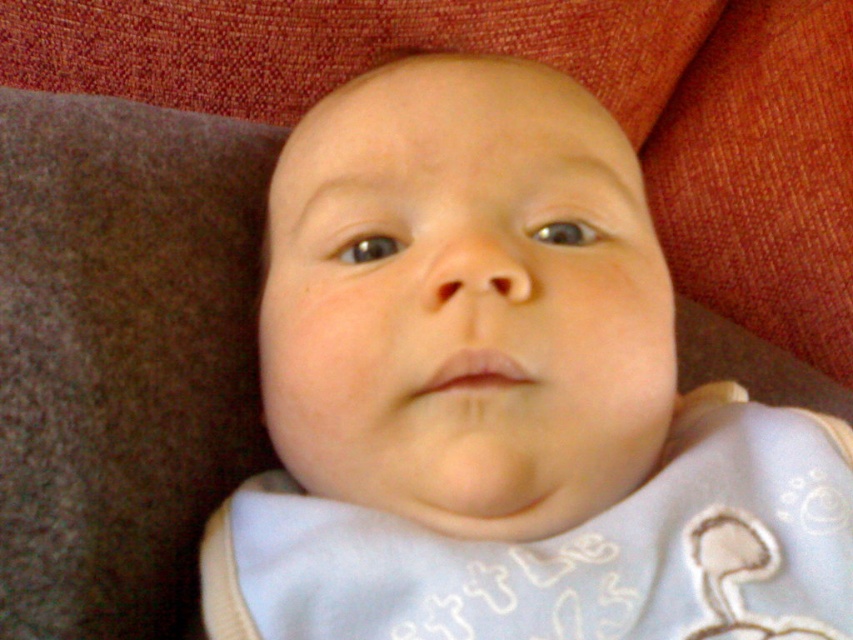
Question: Which object is positioned closest to the smooth white bib at center?

Choices:
 (A) soft cotton blanket at upper center
 (B) light blue fabric bib at center

Answer: (B)

Question: Does smooth white bib at center appear on the left side of soft cotton blanket at upper center?

Choices:
 (A) yes
 (B) no

Answer: (B)

Question: Which point appears closest to the camera in this image?

Choices:
 (A) (49, 17)
 (B) (239, 532)

Answer: (B)

Question: Which of the following is the farthest from the observer?

Choices:
 (A) light blue fabric bib at center
 (B) smooth white bib at center
 (C) soft cotton blanket at upper center

Answer: (C)

Question: Is soft cotton blanket at upper center positioned at the back of light blue fabric bib at center?

Choices:
 (A) yes
 (B) no

Answer: (A)

Question: Does smooth white bib at center appear on the right side of light blue fabric bib at center?

Choices:
 (A) yes
 (B) no

Answer: (B)